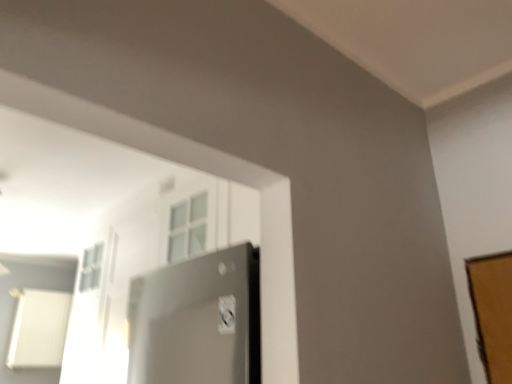
Describe the element at coordinates (39, 329) in the screenshot. I see `white matte window at left` at that location.

Measure the distance between white matte window at left and camera.

white matte window at left and camera are 10.92 feet apart.

What are the coordinates of `white matte window at left` in the screenshot? It's located at [x=39, y=329].

This screenshot has width=512, height=384. I want to click on white matte window at left, so click(x=39, y=329).